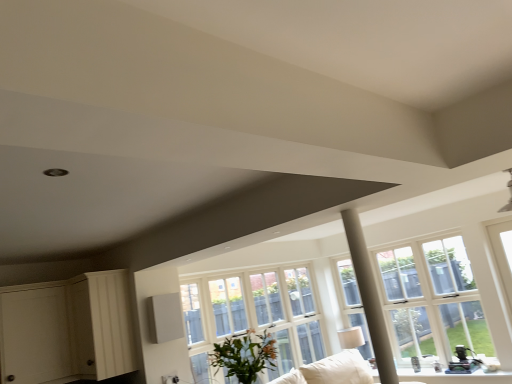
Question: Is clear glass window at center not close to white fabric couch at lower center?

Choices:
 (A) yes
 (B) no

Answer: (A)

Question: Is clear glass window at center thinner than white fabric couch at lower center?

Choices:
 (A) yes
 (B) no

Answer: (A)

Question: From a real-world perspective, is clear glass window at center on top of white fabric couch at lower center?

Choices:
 (A) no
 (B) yes

Answer: (B)

Question: Would you say clear glass window at center contains white fabric couch at lower center?

Choices:
 (A) yes
 (B) no

Answer: (B)

Question: Does clear glass window at center touch white fabric couch at lower center?

Choices:
 (A) yes
 (B) no

Answer: (B)

Question: From the image's perspective, is white wood dresser at lower left above or below green leafy plant at center?

Choices:
 (A) below
 (B) above

Answer: (B)

Question: In terms of height, does white wood dresser at lower left look taller or shorter compared to green leafy plant at center?

Choices:
 (A) short
 (B) tall

Answer: (B)

Question: Visually, is white wood dresser at lower left positioned to the left or to the right of green leafy plant at center?

Choices:
 (A) left
 (B) right

Answer: (A)

Question: Considering the positions of white wood dresser at lower left and green leafy plant at center in the image, is white wood dresser at lower left bigger or smaller than green leafy plant at center?

Choices:
 (A) small
 (B) big

Answer: (B)

Question: Choose the correct answer: Is white wood dresser at lower left inside white fabric couch at lower center or outside it?

Choices:
 (A) outside
 (B) inside

Answer: (A)

Question: Is white wood dresser at lower left bigger or smaller than white fabric couch at lower center?

Choices:
 (A) big
 (B) small

Answer: (B)

Question: From a real-world perspective, is white wood dresser at lower left positioned above or below white fabric couch at lower center?

Choices:
 (A) above
 (B) below

Answer: (A)

Question: In the image, is white wood dresser at lower left positioned in front of or behind white fabric couch at lower center?

Choices:
 (A) behind
 (B) front

Answer: (B)

Question: Would you say clear glass window at center is to the left or to the right of green leafy plant at center in the picture?

Choices:
 (A) left
 (B) right

Answer: (B)

Question: From a real-world perspective, relative to green leafy plant at center, is clear glass window at center vertically above or below?

Choices:
 (A) above
 (B) below

Answer: (A)